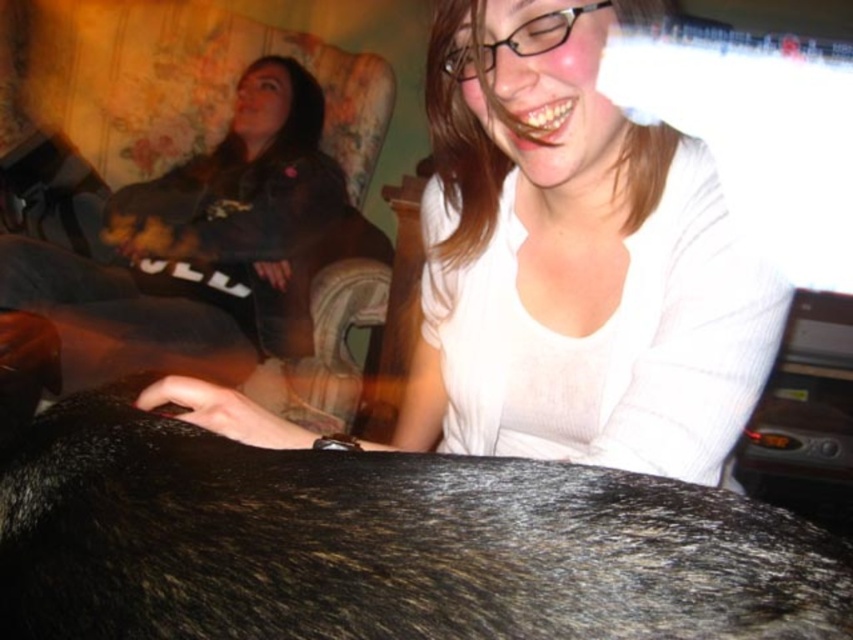
You are a fashion designer analyzing the image. Which clothing item is shorter in height between the white ribbed shirt at center and the dark gray hoodie at upper left?

The white ribbed shirt at center is shorter than the dark gray hoodie at upper left.

You are a photographer trying to capture a candid shot of the scene. You want to ensure that both the shiny black fur at center and the white ribbed shirt at center are visible in your photo. Based on their positions, which object should you focus on first to frame them both properly?

The shiny black fur at center is positioned on the left side of white ribbed shirt at center. To frame both properly, focus on the shiny black fur at center first as it is on the left, then adjust to include the white ribbed shirt at center on the right.